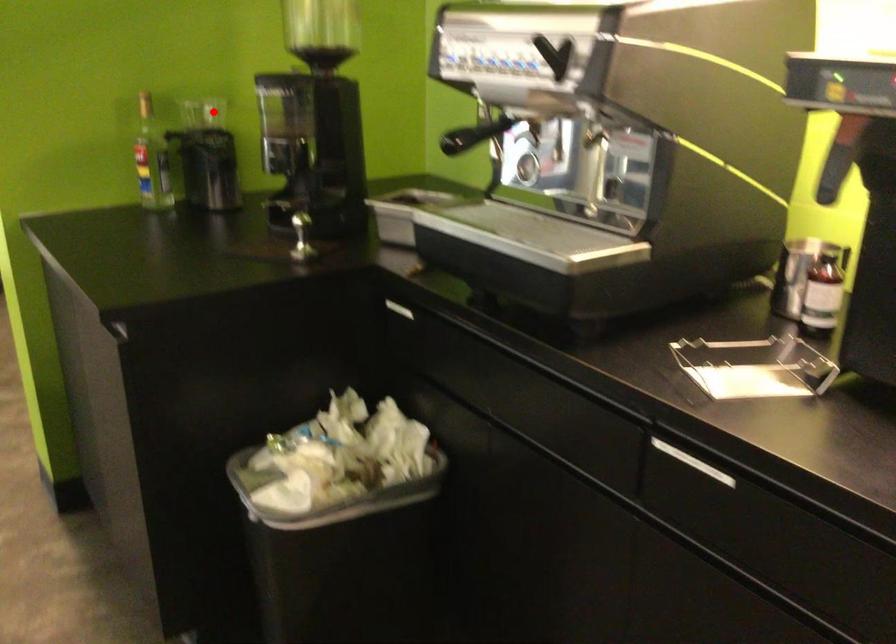
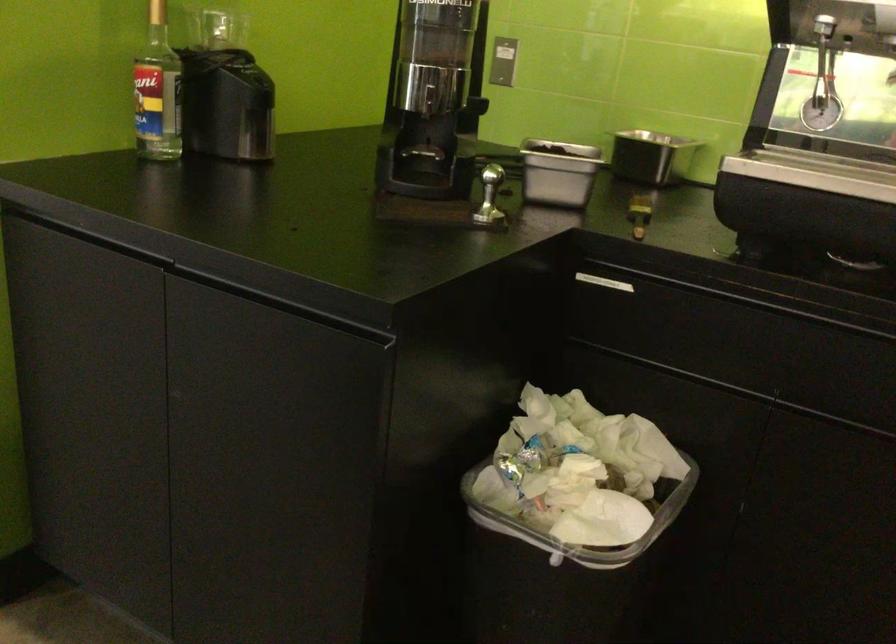
Where in the second image is the point corresponding to the highlighted location from the first image?

(216, 29)